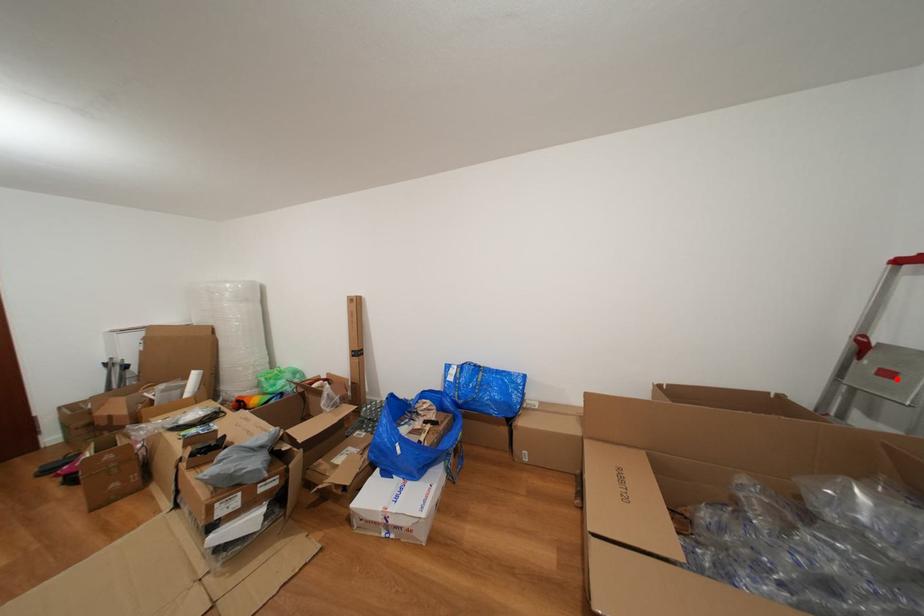
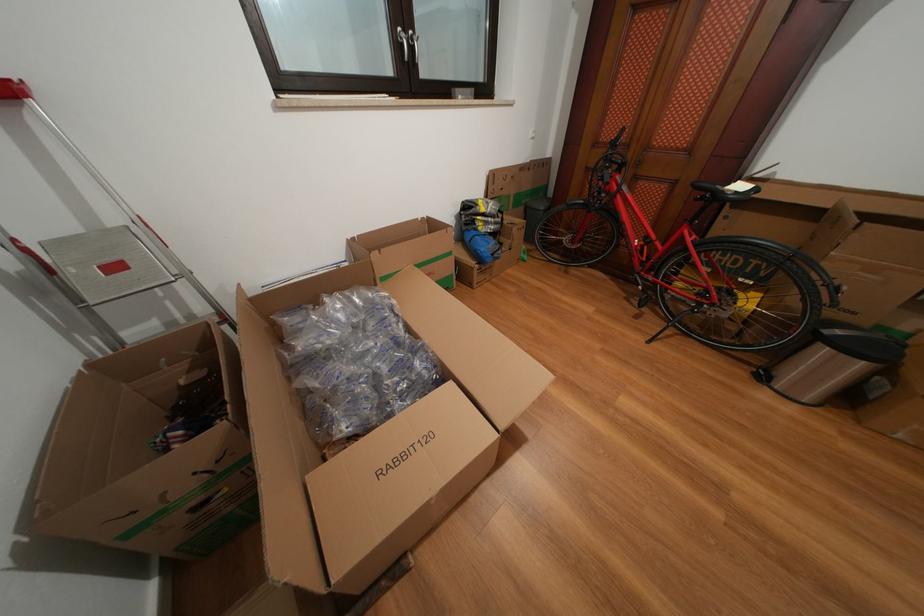
Find the pixel in the second image that matches the highlighted location in the first image.

(124, 273)